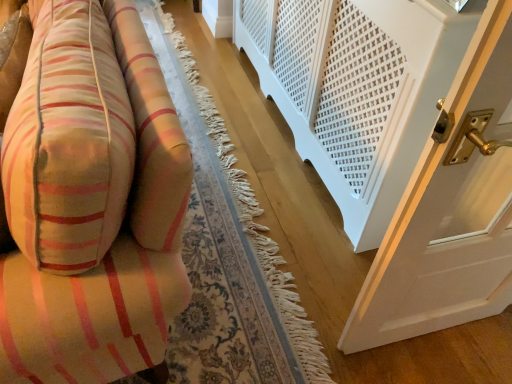
Question: Can you confirm if white textured radiator at lower right is thinner than soft cotton cushion at left?

Choices:
 (A) yes
 (B) no

Answer: (A)

Question: Can we say white textured radiator at lower right lies outside soft cotton cushion at left?

Choices:
 (A) no
 (B) yes

Answer: (B)

Question: Would you consider white textured radiator at lower right to be distant from soft cotton cushion at left?

Choices:
 (A) yes
 (B) no

Answer: (B)

Question: From the image's perspective, would you say white textured radiator at lower right is shown under soft cotton cushion at left?

Choices:
 (A) yes
 (B) no

Answer: (B)

Question: From a real-world perspective, does white textured radiator at lower right stand above soft cotton cushion at left?

Choices:
 (A) yes
 (B) no

Answer: (B)

Question: Is white textured radiator at lower right further to camera compared to soft cotton cushion at left?

Choices:
 (A) no
 (B) yes

Answer: (B)

Question: From the image's perspective, is soft cotton cushion at left over white textured radiator at lower right?

Choices:
 (A) yes
 (B) no

Answer: (B)

Question: Is the position of soft cotton cushion at left more distant than that of white textured radiator at lower right?

Choices:
 (A) no
 (B) yes

Answer: (A)

Question: Can you confirm if soft cotton cushion at left is bigger than white textured radiator at lower right?

Choices:
 (A) no
 (B) yes

Answer: (A)

Question: Is there a large distance between soft cotton cushion at left and white textured radiator at lower right?

Choices:
 (A) no
 (B) yes

Answer: (A)

Question: Would you say soft cotton cushion at left is outside white textured radiator at lower right?

Choices:
 (A) yes
 (B) no

Answer: (A)

Question: Does soft cotton cushion at left have a smaller size compared to white textured radiator at lower right?

Choices:
 (A) no
 (B) yes

Answer: (B)

Question: Relative to white textured radiator at lower right, is soft cotton cushion at left in front or behind?

Choices:
 (A) front
 (B) behind

Answer: (A)